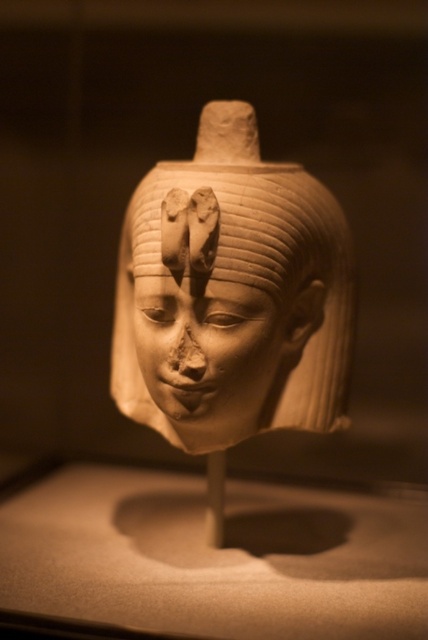
You are a curator planning to install a spotlight in the museum. The spotlight has a beam width of 0.4 meters. The point at coordinates point (231,292) is where the matte beige statue at center is located. Can you determine if the spotlight will illuminate the entire matte beige statue at center?

The point at coordinates point (231,292) marks the location of the matte beige statue at center. Since the spotlight has a beam width of 0.4 meters, it can only cover an area of 0.4 meters in diameter. If the statue is larger than this, it wonwot be fully illuminated. However, the description does not provide the statue size, so we cannot confirm if the spotlight will cover it entirely.

You are a museum curator arranging the display case. You need to ensure that the matte beige statue at center and the matte beige face at center are positioned so that the statue is elevated for better visibility. Is the current arrangement meeting this requirement?

Yes, the matte beige statue at center is already positioned above the matte beige face at center, which means it is elevated and likely provides better visibility as required.

You are a museum security guard standing at the entrance of the room. You need to locate the matte beige statue at center. Based on the coordinates provided, where should you look in the display case?

The matte beige statue at center is located at the 2D coordinates point (231, 292) in the display case.